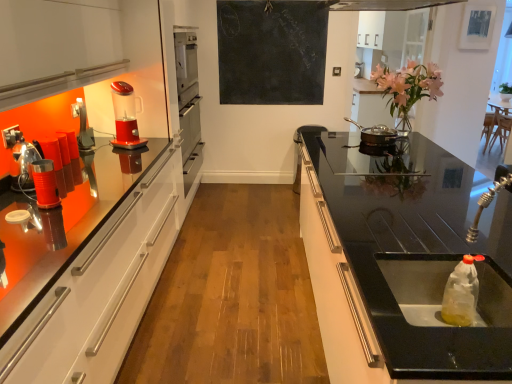
Question: Does metallic stainless steel cup at left, the 2th appliance positioned from the front, have a greater height compared to translucent plastic sink at lower right?

Choices:
 (A) no
 (B) yes

Answer: (B)

Question: Is metallic stainless steel cup at left, which is the 2th appliance in back-to-front order, next to translucent plastic sink at lower right and touching it?

Choices:
 (A) yes
 (B) no

Answer: (B)

Question: From the image's perspective, is metallic stainless steel cup at left, marked as the 1th appliance in a left-to-right arrangement, under translucent plastic sink at lower right?

Choices:
 (A) no
 (B) yes

Answer: (A)

Question: Does metallic stainless steel cup at left, which is the 2th appliance in back-to-front order, come in front of translucent plastic sink at lower right?

Choices:
 (A) no
 (B) yes

Answer: (A)

Question: Is metallic stainless steel cup at left, marked as the 1th appliance in a left-to-right arrangement, far away from translucent plastic sink at lower right?

Choices:
 (A) yes
 (B) no

Answer: (A)

Question: Does metallic stainless steel cup at left, the 2th appliance positioned from the front, have a larger size compared to translucent plastic sink at lower right?

Choices:
 (A) no
 (B) yes

Answer: (A)

Question: Does translucent plastic blender at left have a greater width compared to shiny silver pan at center, the first appliance when ordered from right to left?

Choices:
 (A) no
 (B) yes

Answer: (A)

Question: From a real-world perspective, is translucent plastic blender at left physically above shiny silver pan at center, the 1th appliance viewed from the back?

Choices:
 (A) yes
 (B) no

Answer: (A)

Question: Does translucent plastic blender at left have a lesser width compared to shiny silver pan at center, placed as the 3th appliance when sorted from front to back?

Choices:
 (A) no
 (B) yes

Answer: (B)

Question: Is the depth of translucent plastic blender at left less than that of shiny silver pan at center, which ranks as the 3th appliance in left-to-right order?

Choices:
 (A) no
 (B) yes

Answer: (B)

Question: Is translucent plastic blender at left at the left side of shiny silver pan at center, which ranks as the 3th appliance in left-to-right order?

Choices:
 (A) yes
 (B) no

Answer: (A)

Question: Can you confirm if translucent plastic blender at left is shorter than shiny silver pan at center, which ranks as the 3th appliance in left-to-right order?

Choices:
 (A) no
 (B) yes

Answer: (A)

Question: From a real-world perspective, is black chalkboard at upper center over metallic red canister at left, marked as the 2th appliance in a left-to-right arrangement?

Choices:
 (A) no
 (B) yes

Answer: (B)